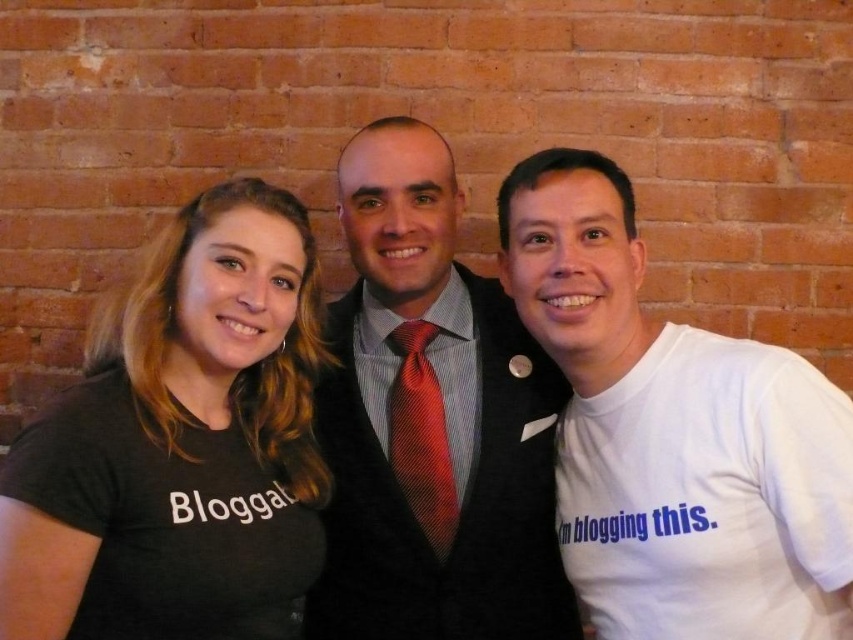
Question: Which object appears closest to the camera in this image?

Choices:
 (A) red silk tie at center
 (B) black t-shirt at left

Answer: (B)

Question: Is black t-shirt at left closer to camera compared to white cotton t-shirt at right?

Choices:
 (A) yes
 (B) no

Answer: (A)

Question: Which point is closer to the camera?

Choices:
 (A) white cotton t-shirt at right
 (B) shiny silk tie at center
 (C) black t-shirt at left

Answer: (C)

Question: Which of the following is the closest to the observer?

Choices:
 (A) black t-shirt at left
 (B) shiny silk tie at center

Answer: (A)

Question: Is black t-shirt at left below shiny silk tie at center?

Choices:
 (A) yes
 (B) no

Answer: (A)

Question: Is white cotton t-shirt at right to the left of red silk tie at center from the viewer's perspective?

Choices:
 (A) yes
 (B) no

Answer: (B)